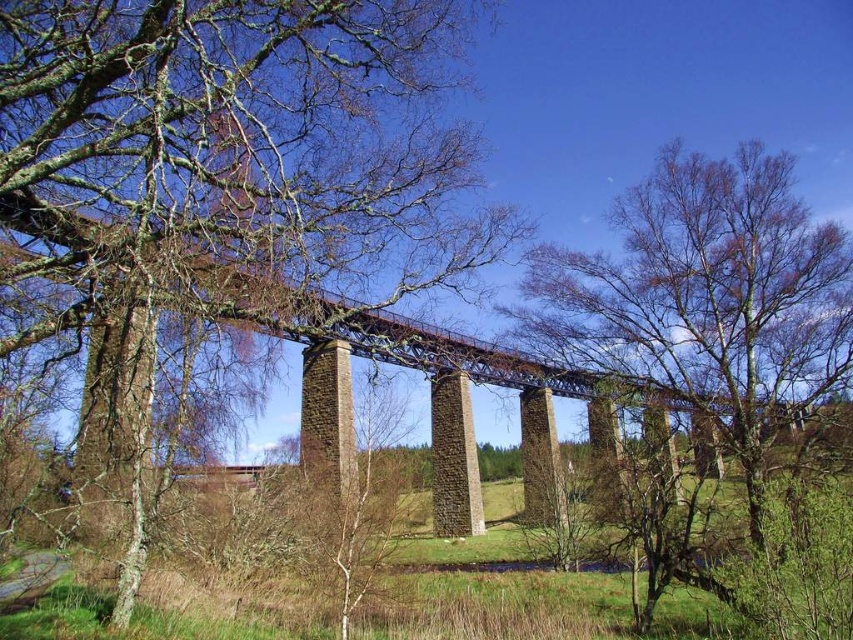
You are standing in front of the viaduct and notice two points marked on the structure. The first point is at coordinate point [466,237] and the second is at point [16,209]. Which of these points is closer to your current position?

Point [16,209] is closer to your current position because it is nearer to the camera compared to point [466,237], which is further away.

You are an artist planning to paint the scene with the smooth bark tree at center and the green leafy tree at center. Which tree should you focus on to capture more details due to its size?

The green leafy tree at center should be focused on for more details because it occupies more space than the smooth bark tree at center.

You are an arborist assessing two trees in the center of the scene. The smooth bark tree at center and the green leafy tree at center. Which tree has a wider trunk?

The smooth bark tree at center has a larger width than the green leafy tree at center, so the smooth bark tree at center has a wider trunk.